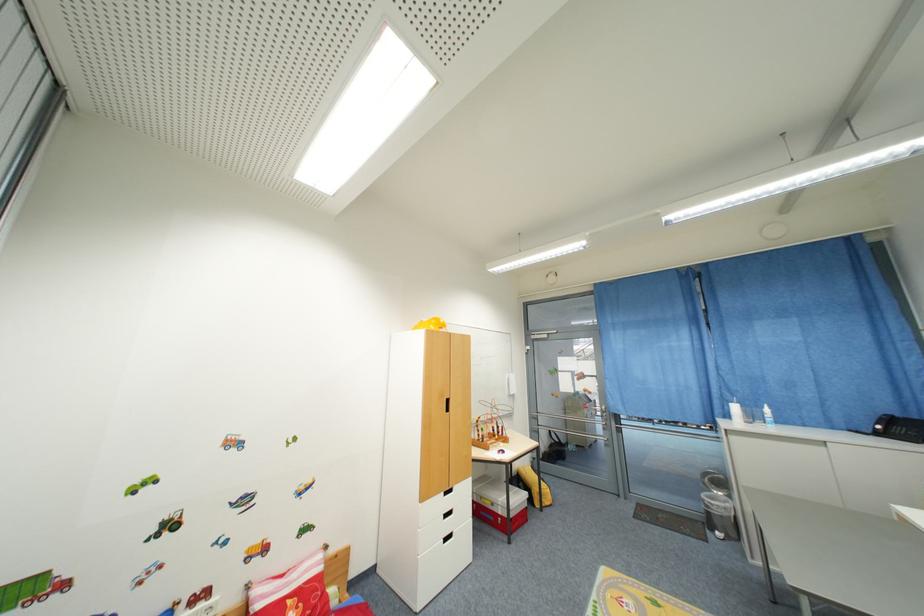
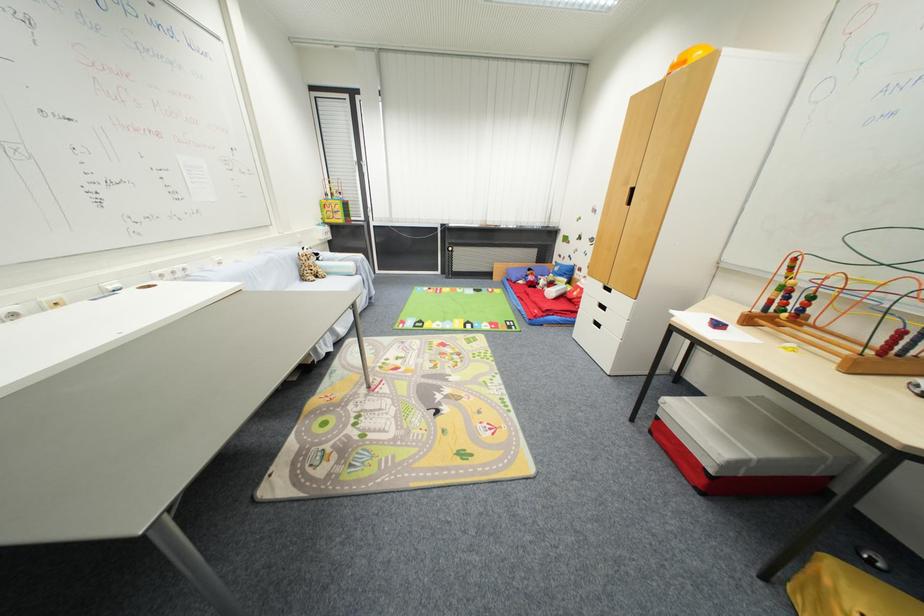
Find the pixel in the second image that matches the point at 500,438 in the first image.

(789, 313)